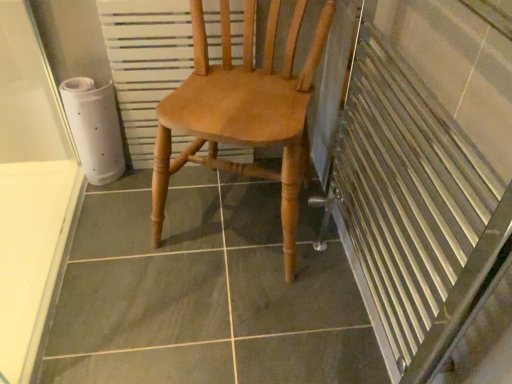
Question: Is white textured radiator at center situated inside light brown wood chair at center or outside?

Choices:
 (A) outside
 (B) inside

Answer: (B)

Question: From the image's perspective, is white textured radiator at center above or below light brown wood chair at center?

Choices:
 (A) above
 (B) below

Answer: (A)

Question: From a real-world perspective, is white textured radiator at center above or below light brown wood chair at center?

Choices:
 (A) above
 (B) below

Answer: (B)

Question: Considering the positions of light brown wood chair at center and white textured radiator at center in the image, is light brown wood chair at center bigger or smaller than white textured radiator at center?

Choices:
 (A) small
 (B) big

Answer: (B)

Question: From a real-world perspective, relative to white textured radiator at center, is light brown wood chair at center vertically above or below?

Choices:
 (A) above
 (B) below

Answer: (A)

Question: In terms of height, does light brown wood chair at center look taller or shorter compared to white textured radiator at center?

Choices:
 (A) tall
 (B) short

Answer: (A)

Question: Is point (291, 102) closer or farther from the camera than point (132, 1)?

Choices:
 (A) closer
 (B) farther

Answer: (A)